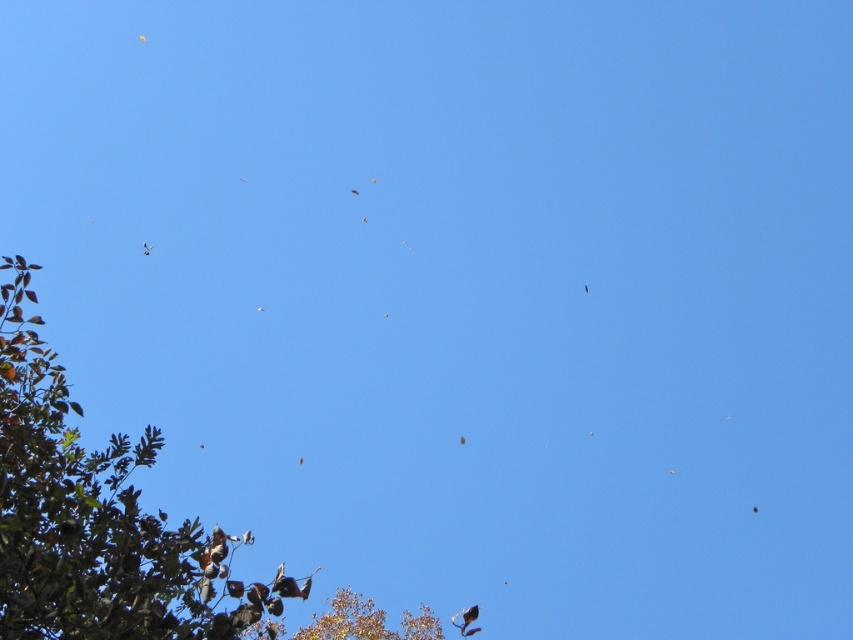
You are an ornithologist observing birds in the sky. You notice two trees in the scene. Which tree, the brown leafy tree at left or the brown leafy tree at lower left, is taller?

The brown leafy tree at lower left is taller than the brown leafy tree at left.

You are a birdwatcher trying to observe the white feathered bird at upper left and the brown feathered bird at center. If you have a telescope with a 5 meter range, can you see both birds clearly with the same telescope setting?

The distance between the white feathered bird at upper left and the brown feathered bird at center is 8.03 meters. Since the telescope has a 5 meter range, you cannot adjust the same setting to view both birds clearly as they are beyond the 5 meter range from each other.

From the picture: You are an astronomer observing the sky and notice two points of interest labeled as point (469, 612) and point (584, 289). Based on their positions, which one is nearer to you?

Point (469, 612) is closer to the viewer than point (584, 289).